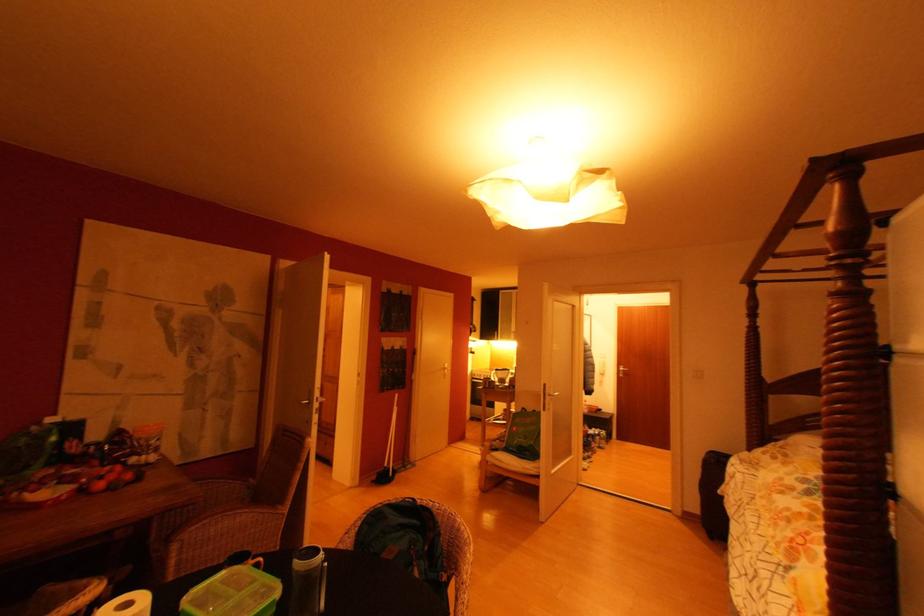
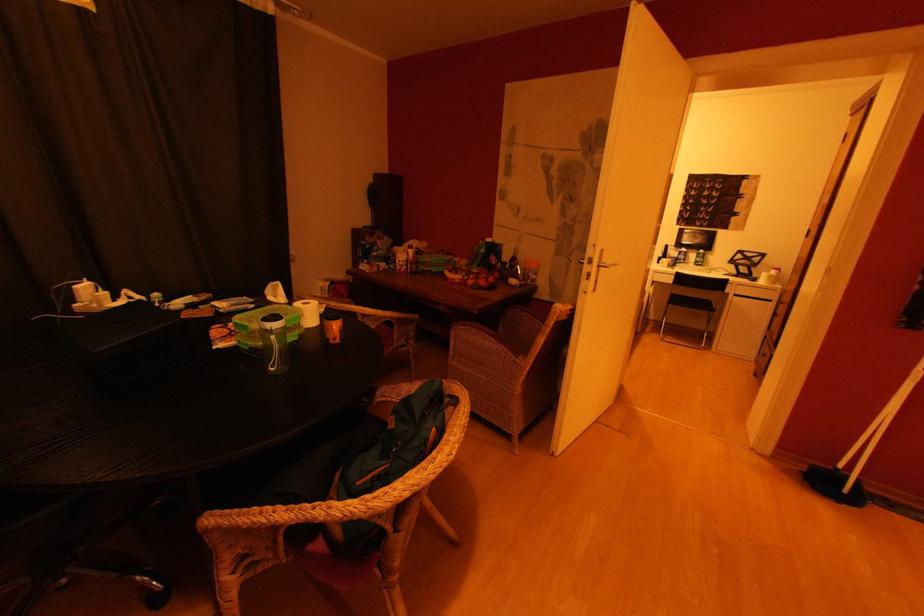
Where in the second image is the point corresponding to [319,413] from the first image?

(590, 277)